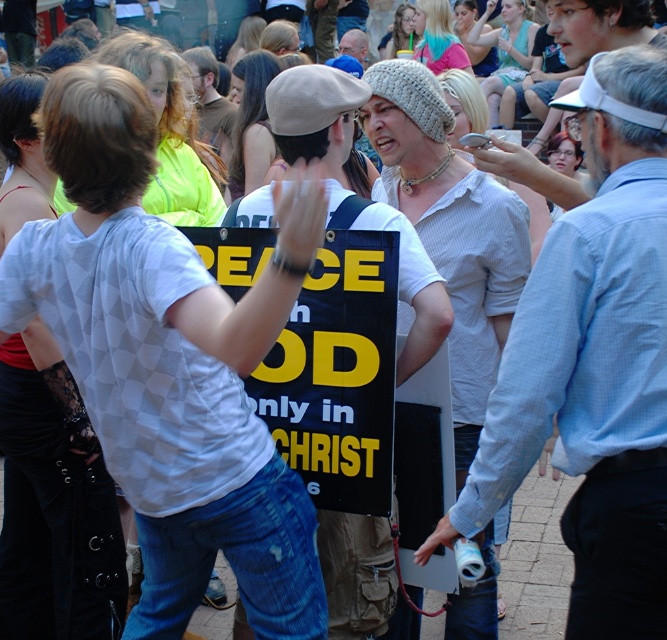
You are a photographer standing in the scene and want to take a photo of both the light blue shirt at center and the knitted wool hat at center. Which object should you focus on first to ensure both are in clear view?

The light blue shirt at center is closer to the viewer than the knitted wool hat at center, so focusing on the light blue shirt at center first will ensure both are in clear view.

You are a photographer at the event and want to capture both the light blue shirt at center and the matte plastic cup at upper center in a single photo. Considering their sizes, which object should you focus on to ensure both are clearly visible in the frame?

The light blue shirt at center is much taller than the matte plastic cup at upper center, so focusing on the light blue shirt at center would ensure both are clearly visible as it occupies more space in the frame.